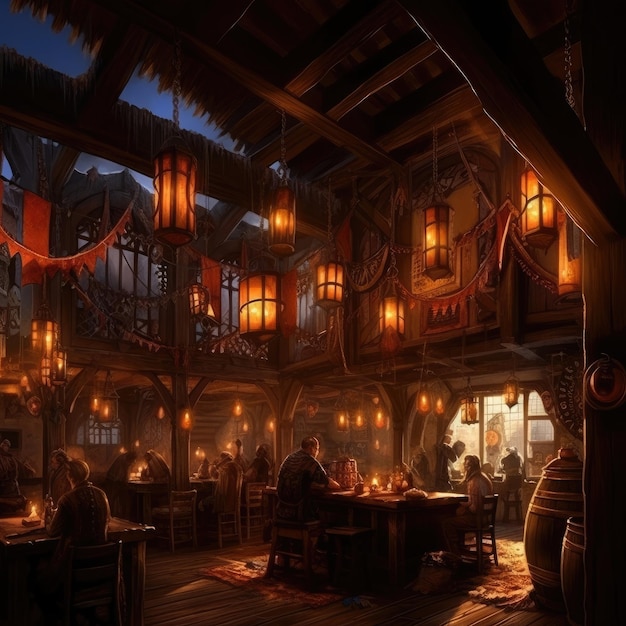
The width and height of the screenshot is (626, 626). In order to click on empty space on table in this screenshot , I will do `click(121, 523)`.